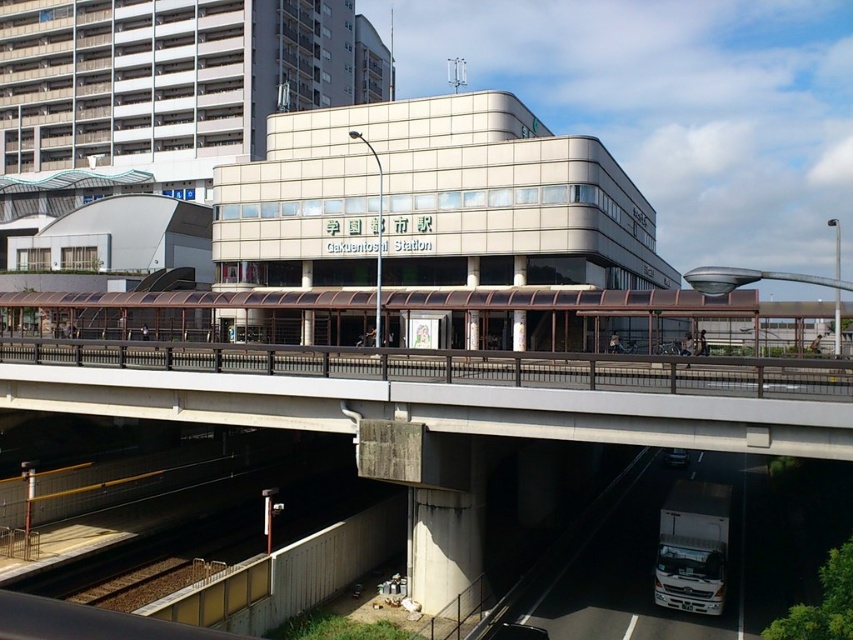
You are a pedestrian trying to cross the street safely. You see a concrete bridge at center and a white glossy truck at lower right. Which object should you use to cross the street?

You should use the concrete bridge at center to cross the street because it is designed for pedestrians and is positioned in front of the white glossy truck at lower right, indicating it is the appropriate path.

You are standing at the Gakuen Toeki Station and looking at the pedestrian overpass in front of you. There are two points marked on the overpass. Which point is closer to you, point (688, 531) or point (683, 456)?

Point (688, 531) is closer to you than point (683, 456).